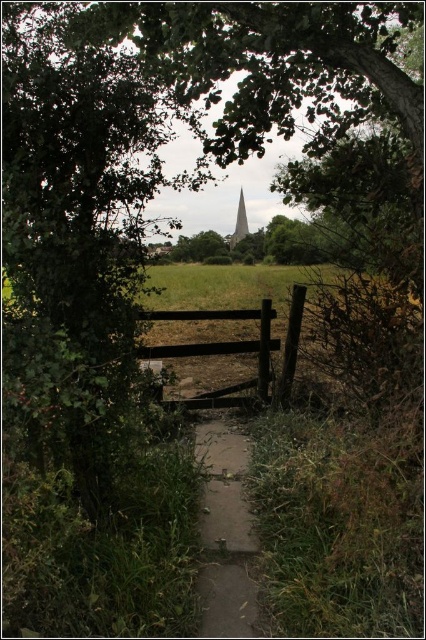
Between brown wooden fence at center and smooth stone tower at center, which one is positioned lower?

brown wooden fence at center is below.

Which is in front, point (259, 346) or point (236, 224)?

Point (259, 346) is in front.

Describe the element at coordinates (218, 353) in the screenshot. This screenshot has height=640, width=426. I see `brown wooden fence at center` at that location.

At what (x,y) coordinates should I click in order to perform the action: click on brown wooden fence at center. Please return your answer as a coordinate pair (x, y). This screenshot has width=426, height=640. Looking at the image, I should click on (218, 353).

Is dull concrete path at center further to the viewer compared to smooth stone tower at center?

No, it is in front of smooth stone tower at center.

Which of these two, dull concrete path at center or smooth stone tower at center, stands shorter?

dull concrete path at center is shorter.

Between point (236, 490) and point (241, 214), which one is positioned behind?

The point (241, 214) is more distant.

Find the location of a particular element. The width and height of the screenshot is (426, 640). dull concrete path at center is located at coordinates (226, 536).

Which of these two, dull concrete path at center or brown wooden fence at center, stands taller?

brown wooden fence at center

Is dull concrete path at center thinner than brown wooden fence at center?

Correct, dull concrete path at center's width is less than brown wooden fence at center's.

Does point (226, 625) come in front of point (193, 348)?

Yes, point (226, 625) is closer to viewer.

Find the location of `dull concrete path at center`. dull concrete path at center is located at coordinates (226, 536).